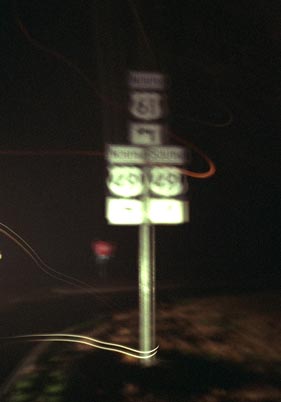
Identify the location of floor. (213, 337).